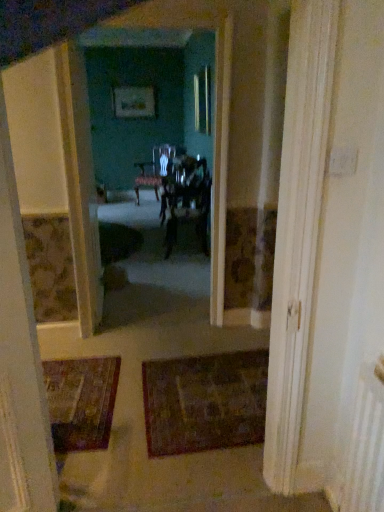
Question: Considering the relative sizes of wooden glossy chair at center, the first chair in the front-to-back sequence, and matte black chair at center, the first chair in the left-to-right sequence, in the image provided, is wooden glossy chair at center, the first chair in the front-to-back sequence, thinner than matte black chair at center, the first chair in the left-to-right sequence,?

Choices:
 (A) yes
 (B) no

Answer: (A)

Question: Considering the relative sizes of wooden glossy chair at center, the second chair viewed from the top, and matte black chair at center, the first chair in the left-to-right sequence, in the image provided, is wooden glossy chair at center, the second chair viewed from the top, taller than matte black chair at center, the first chair in the left-to-right sequence,?

Choices:
 (A) yes
 (B) no

Answer: (B)

Question: Is wooden glossy chair at center, positioned as the 2th chair in back-to-front order, placed right next to matte black chair at center, the first chair in the left-to-right sequence?

Choices:
 (A) no
 (B) yes

Answer: (A)

Question: Does wooden glossy chair at center, positioned as the second chair in left-to-right order, have a lesser height compared to matte black chair at center, the 2th chair from the right?

Choices:
 (A) yes
 (B) no

Answer: (A)

Question: Does wooden glossy chair at center, positioned as the second chair in left-to-right order, have a greater width compared to matte black chair at center, the second chair in the bottom-to-top sequence?

Choices:
 (A) no
 (B) yes

Answer: (A)

Question: From the image's perspective, is wooden glossy chair at center, which is counted as the first chair, starting from the bottom, on matte black chair at center, the first chair in the left-to-right sequence?

Choices:
 (A) no
 (B) yes

Answer: (A)

Question: From a real-world perspective, is matte black chair at center, the 2th chair from the right, physically below wooden glossy chair at center, which is the first chair in right-to-left order?

Choices:
 (A) yes
 (B) no

Answer: (B)

Question: Can we say matte black chair at center, the 2th chair from the right, lies outside wooden glossy chair at center, positioned as the 2th chair in back-to-front order?

Choices:
 (A) yes
 (B) no

Answer: (A)

Question: Considering the relative sizes of matte black chair at center, the second chair in the bottom-to-top sequence, and wooden glossy chair at center, which is the first chair in right-to-left order, in the image provided, is matte black chair at center, the second chair in the bottom-to-top sequence, smaller than wooden glossy chair at center, which is the first chair in right-to-left order,?

Choices:
 (A) no
 (B) yes

Answer: (A)

Question: Is matte black chair at center, the second chair from the front, turned away from wooden glossy chair at center, the second chair viewed from the top?

Choices:
 (A) yes
 (B) no

Answer: (B)

Question: Does matte black chair at center, the first chair in the left-to-right sequence, touch wooden glossy chair at center, which is the first chair in right-to-left order?

Choices:
 (A) no
 (B) yes

Answer: (A)

Question: Can you confirm if matte black chair at center, which appears as the first chair when viewed from the top, is wider than wooden glossy chair at center, positioned as the 2th chair in back-to-front order?

Choices:
 (A) no
 (B) yes

Answer: (B)

Question: Is dark brown textured rug at center looking in the opposite direction of matte white door at center?

Choices:
 (A) no
 (B) yes

Answer: (A)